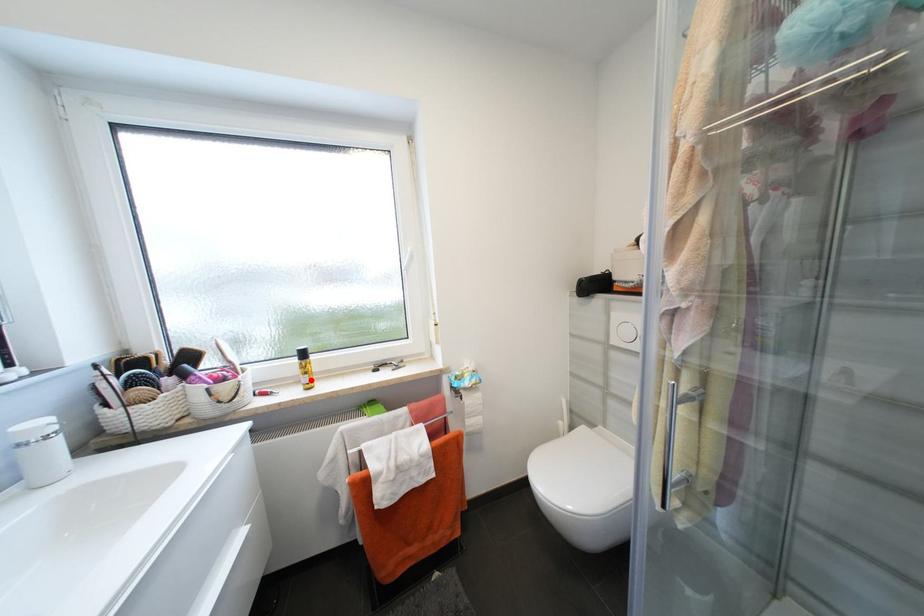
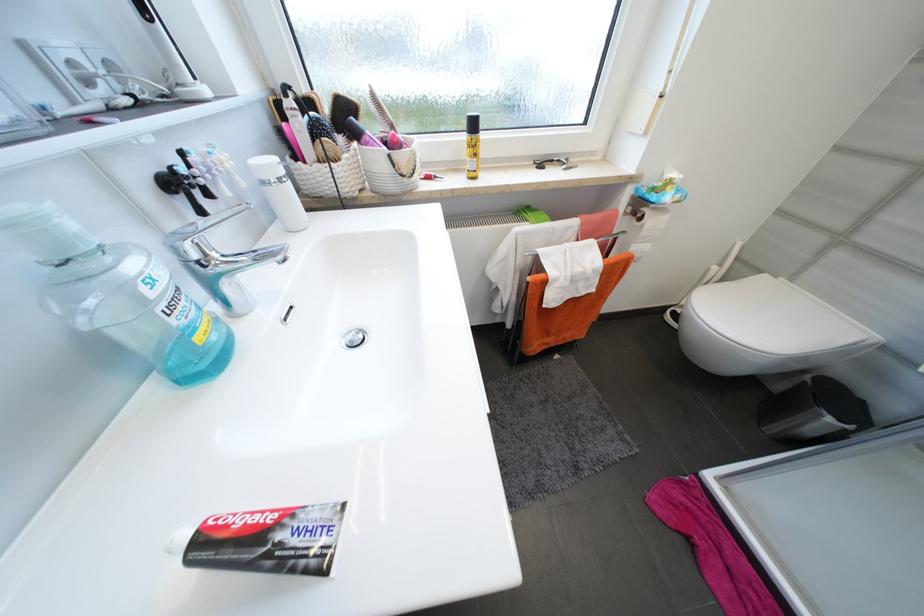
Locate, in the second image, the point that corresponds to the highlighted location in the first image.

(477, 166)